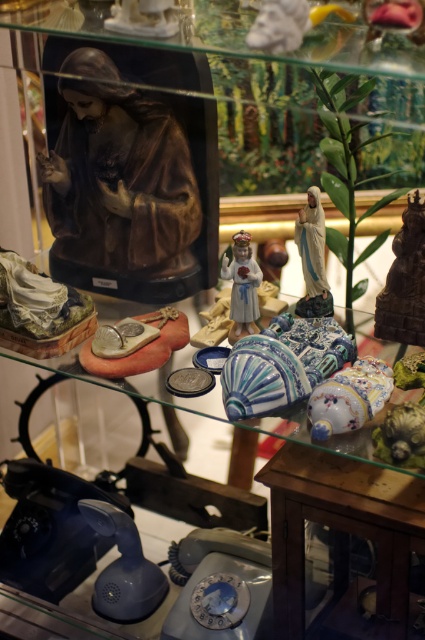
You are an interior designer planning to rearrange the items in the glass cabinet. You want to place a new decorative item between the matte brown statue at upper left and the matte gold statue at right. What is the minimum width this new item should have to fit snugly between them?

The matte brown statue at upper left and the matte gold statue at right are 55.79 centimeters apart. Therefore, the new item should be at least 55.79 centimeters wide to fit snugly between them.

You are an art curator examining the glass cabinet. You need to determine the relative positions of the matte brown statue at upper left and the matte gold statue at right. Which statue is located to the left of the other?

The matte brown statue at upper left is positioned on the left side of the matte gold statue at right.

You are standing in front of the glass cabinet and want to locate the point at coordinates (405, 282). Which object in the cabinet does this point correspond to?

The point at coordinates (405, 282) corresponds to the matte gold statue at right.